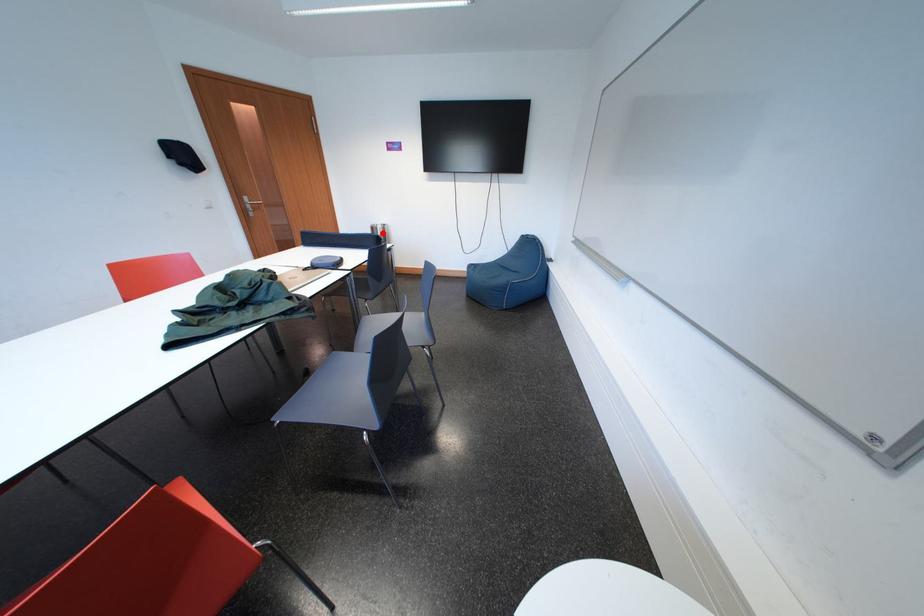
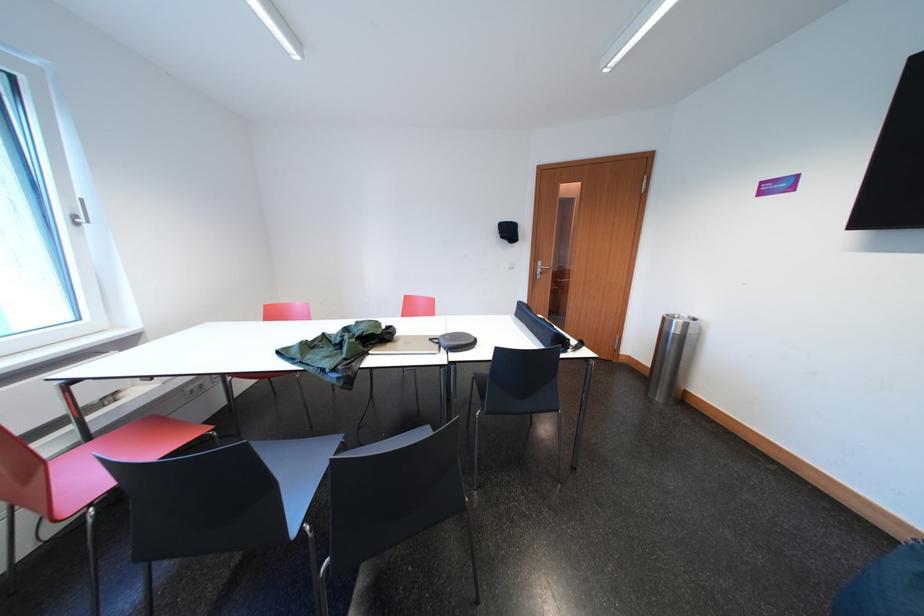
The point at the highlighted location is marked in the first image. Where is the corresponding point in the second image?

(675, 325)